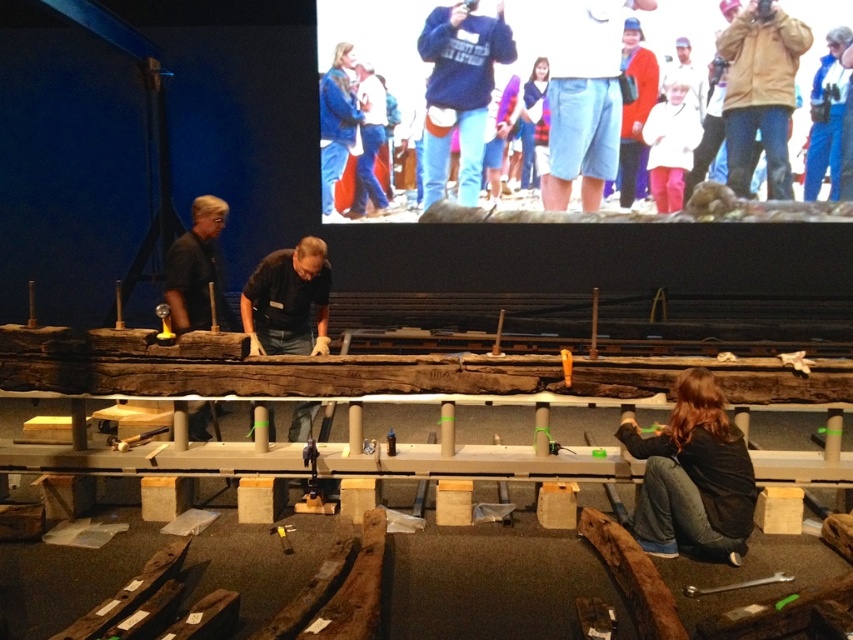
Can you confirm if brown leather jacket at upper right is positioned to the left of matte red sweater at upper right?

In fact, brown leather jacket at upper right is to the right of matte red sweater at upper right.

Describe the element at coordinates (759, 92) in the screenshot. I see `brown leather jacket at upper right` at that location.

At what (x,y) coordinates should I click in order to perform the action: click on brown leather jacket at upper right. Please return your answer as a coordinate pair (x, y). The image size is (853, 640). Looking at the image, I should click on (759, 92).

Can you confirm if dark brown hair at lower right is positioned below denim shorts at center?

Yes, dark brown hair at lower right is below denim shorts at center.

Who is higher up, dark brown hair at lower right or denim shorts at center?

denim shorts at center is above.

You are a GUI agent. You are given a task and a screenshot of the screen. Output one action in this format:
    pyautogui.click(x=<x>, y=<y>)
    Task: Click on the dark brown hair at lower right
    The height and width of the screenshot is (640, 853).
    Given the screenshot: What is the action you would take?
    pyautogui.click(x=692, y=476)

Find the location of a particular element. dark brown hair at lower right is located at coordinates (692, 476).

Does black matte wood at center have a smaller size compared to black matte shirt at left?

Incorrect, black matte wood at center is not smaller in size than black matte shirt at left.

Based on the photo, between black matte wood at center and black matte shirt at left, which one appears on the right side from the viewer's perspective?

Positioned to the right is black matte wood at center.

Which is in front, point (316, 323) or point (187, 288)?

Point (187, 288) is more forward.

I want to click on black matte wood at center, so click(x=288, y=300).